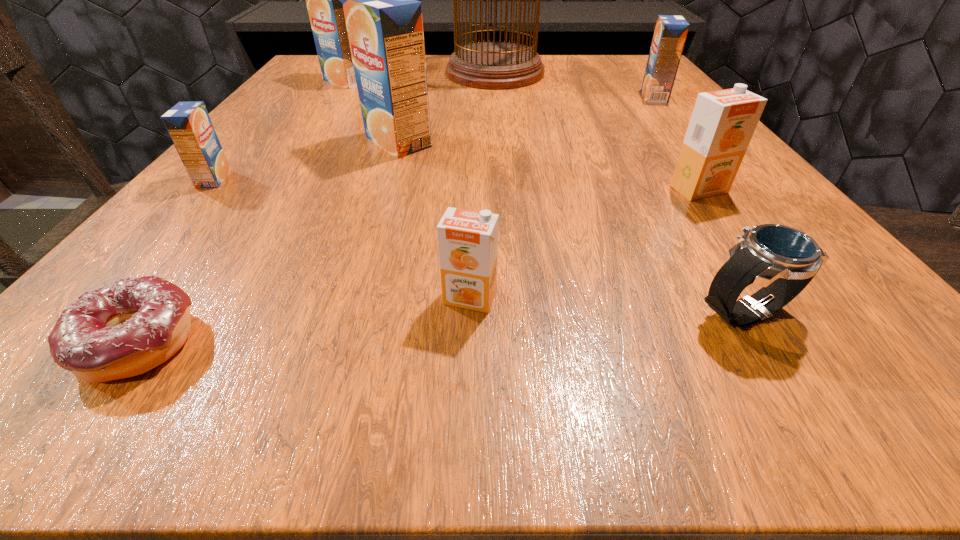
Identify which object is the fifth closest to the birdcage. Please provide its 2D coordinates. Your answer should be formatted as a tuple, i.e. [(x, y)], where the tuple contains the x and y coordinates of a point satisfying the conditions above.

[(189, 125)]

At what (x,y) coordinates should I click in order to perform the action: click on object that stands as the fourth closest to the farther orange orange juice. Please return your answer as a coordinate pair (x, y). Looking at the image, I should click on (384, 23).

Identify which orange juice is the fourth closest to the third orange juice from right to left. Please provide its 2D coordinates. Your answer should be formatted as a tuple, i.e. [(x, y)], where the tuple contains the x and y coordinates of a point satisfying the conditions above.

[(670, 33)]

Identify which orange juice is located as the second nearest to the right orange orange juice. Please provide its 2D coordinates. Your answer should be formatted as a tuple, i.e. [(x, y)], where the tuple contains the x and y coordinates of a point satisfying the conditions above.

[(468, 240)]

Locate which blue orange_juice is the fourth closest to the left orange orange juice. Please provide its 2D coordinates. Your answer should be formatted as a tuple, i.e. [(x, y)], where the tuple contains the x and y coordinates of a point satisfying the conditions above.

[(324, 0)]

Image resolution: width=960 pixels, height=540 pixels. Identify the location of blue orange_juice that is the nearest to the third nearest blue orange_juice. click(384, 23).

Locate an element on the screen. free spot that satisfies the following two spatial constraints: 1. on the front-facing side of the birdcage; 2. on the front side of the third blue orange_juice from left to right is located at coordinates (500, 142).

Find the location of a particular element. vacant area that satisfies the following two spatial constraints: 1. on the front-facing side of the right orange orange juice; 2. on the left side of the birdcage is located at coordinates (504, 190).

What are the coordinates of `free space that satisfies the following two spatial constraints: 1. on the front-facing side of the birdcage; 2. on the left side of the silver watch` in the screenshot? It's located at (514, 312).

You are a GUI agent. You are given a task and a screenshot of the screen. Output one action in this format:
    pyautogui.click(x=<x>, y=<y>)
    Task: Click on the free space that satisfies the following two spatial constraints: 1. on the back side of the doughnut; 2. on the right side of the second farthest blue orange_juice
    This screenshot has height=540, width=960.
    Given the screenshot: What is the action you would take?
    pyautogui.click(x=319, y=97)